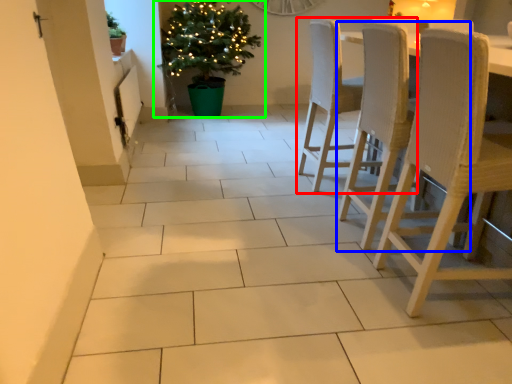
Question: Which object is the farthest from chair (highlighted by a red box)? Choose among these: chair (highlighted by a blue box) or houseplant (highlighted by a green box).

Choices:
 (A) chair
 (B) houseplant

Answer: (B)